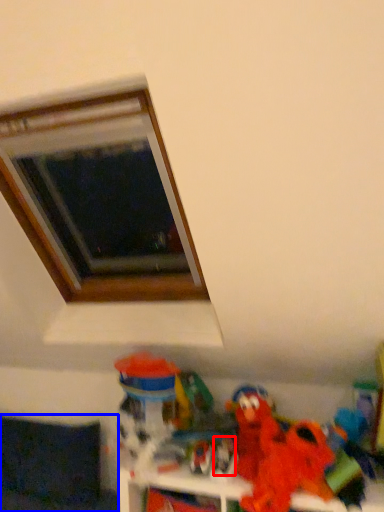
Question: Which object is closer to the camera taking this photo, toy (highlighted by a red box) or couch (highlighted by a blue box)?

Choices:
 (A) toy
 (B) couch

Answer: (A)